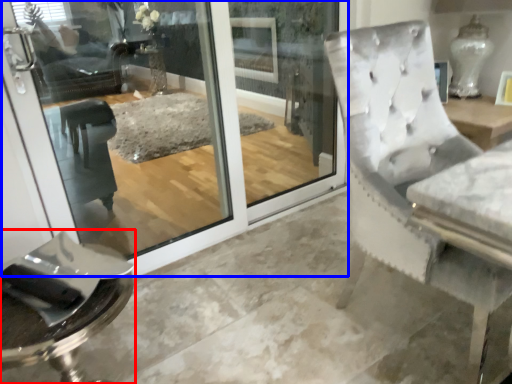
Question: Among these objects, which one is nearest to the camera, furniture (highlighted by a red box) or screen door (highlighted by a blue box)?

Choices:
 (A) furniture
 (B) screen door

Answer: (A)